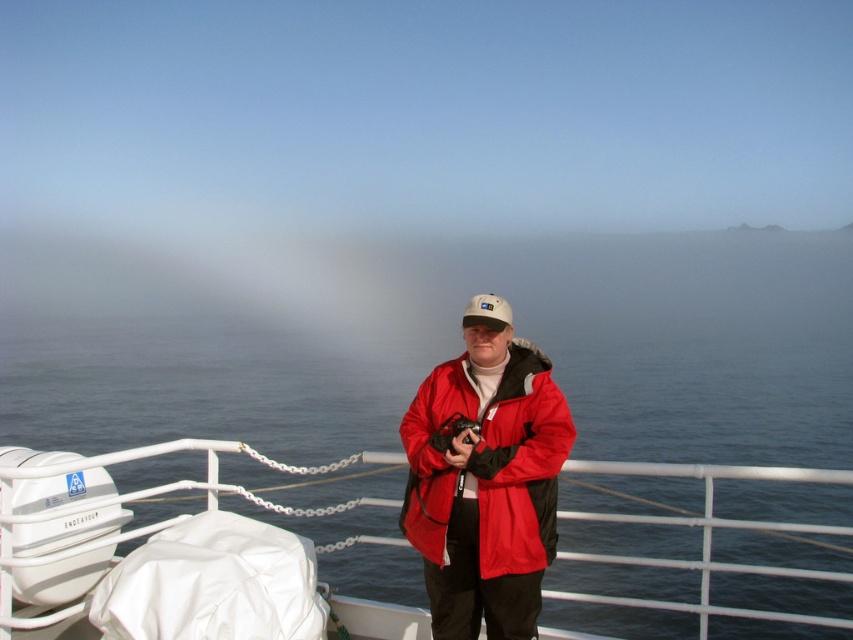
Question: Which point is farther to the camera?

Choices:
 (A) (612, 598)
 (B) (476, 316)
 (C) (540, 420)

Answer: (A)

Question: Which object appears farthest from the camera in this image?

Choices:
 (A) red matte jacket at center
 (B) white fabric cap at center

Answer: (B)

Question: Which object appears closest to the camera in this image?

Choices:
 (A) red matte jacket at center
 (B) white matte boat at center

Answer: (A)

Question: Is red matte jacket at center closer to the viewer compared to white fabric cap at center?

Choices:
 (A) yes
 (B) no

Answer: (A)

Question: In this image, where is white matte boat at center located relative to white fabric cap at center?

Choices:
 (A) right
 (B) left

Answer: (A)

Question: Can you confirm if red matte jacket at center is positioned to the right of white fabric cap at center?

Choices:
 (A) yes
 (B) no

Answer: (B)